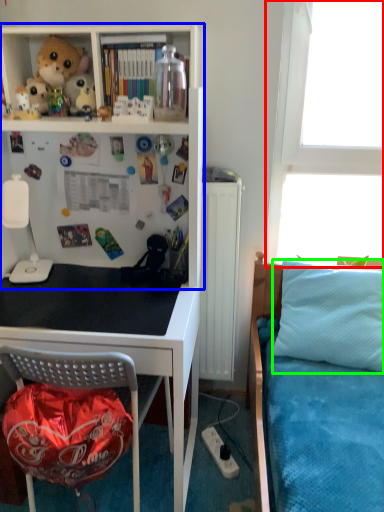
Question: Estimate the real-world distances between objects in this image. Which object is closer to window screen (highlighted by a red box), shelf (highlighted by a blue box) or pillow (highlighted by a green box)?

Choices:
 (A) shelf
 (B) pillow

Answer: (B)